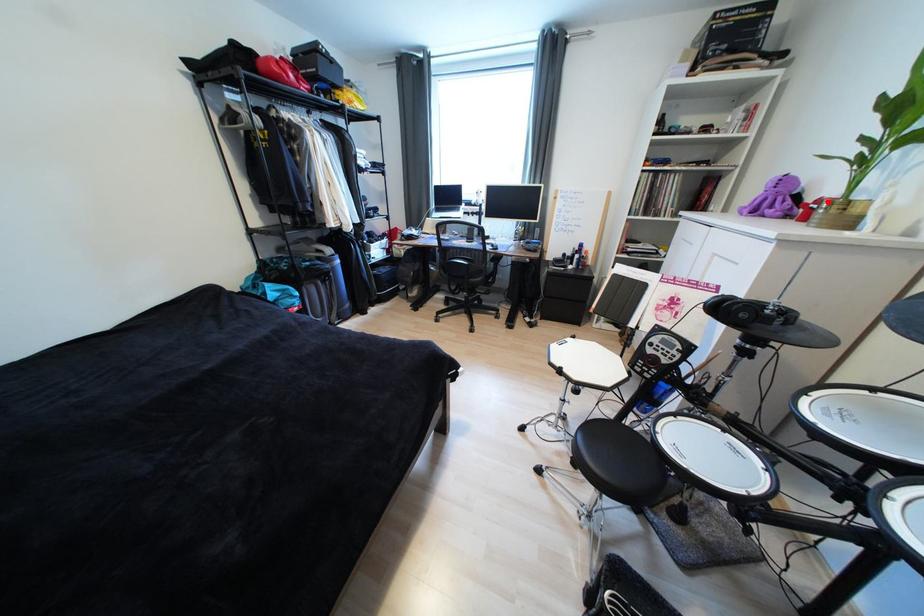
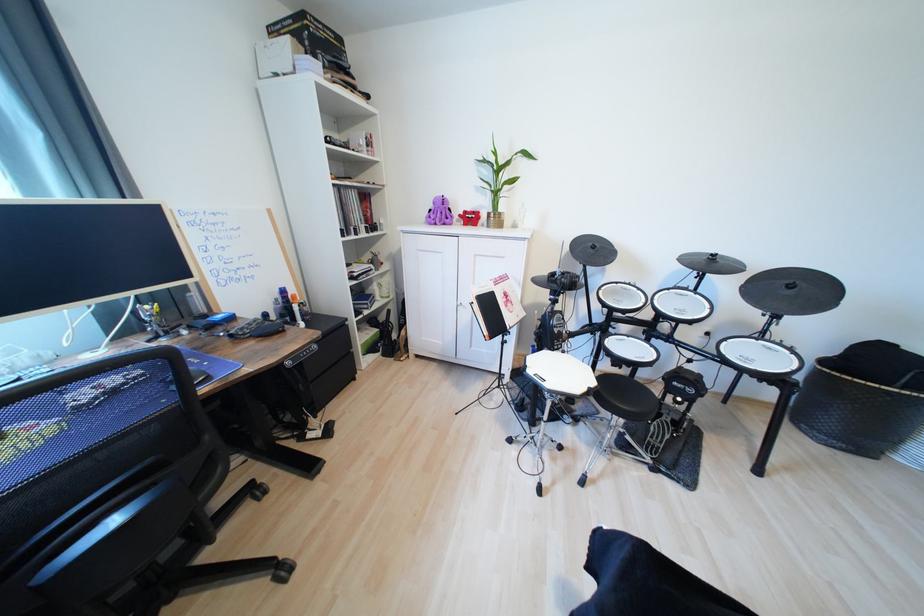
Question: I am providing you with two images of the same scene from different viewpoints. Given a red point in image1, look at the same physical point in image2. Is it:

Choices:
 (A) Closer to the viewpoint
 (B) Farther from the viewpoint

Answer: (A)